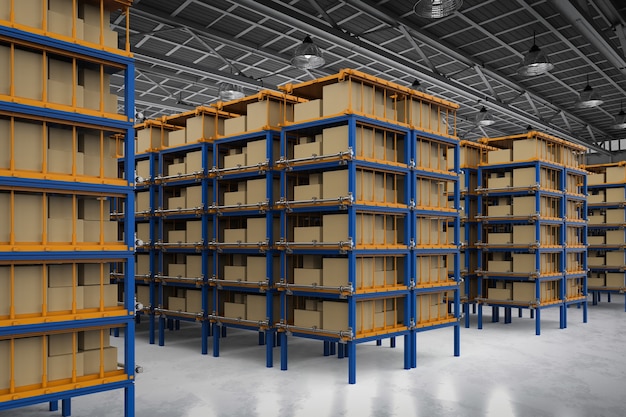
Where is `lights`? The width and height of the screenshot is (626, 417). lights is located at coordinates (312, 57), (433, 5), (536, 66), (590, 108), (233, 94), (488, 119), (618, 122).